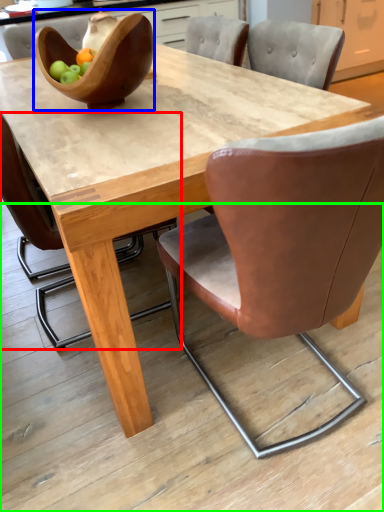
Question: Based on their relative distances, which object is nearer to chair (highlighted by a red box)? Choose from bowl (highlighted by a blue box) and concrete (highlighted by a green box).

Choices:
 (A) bowl
 (B) concrete

Answer: (A)